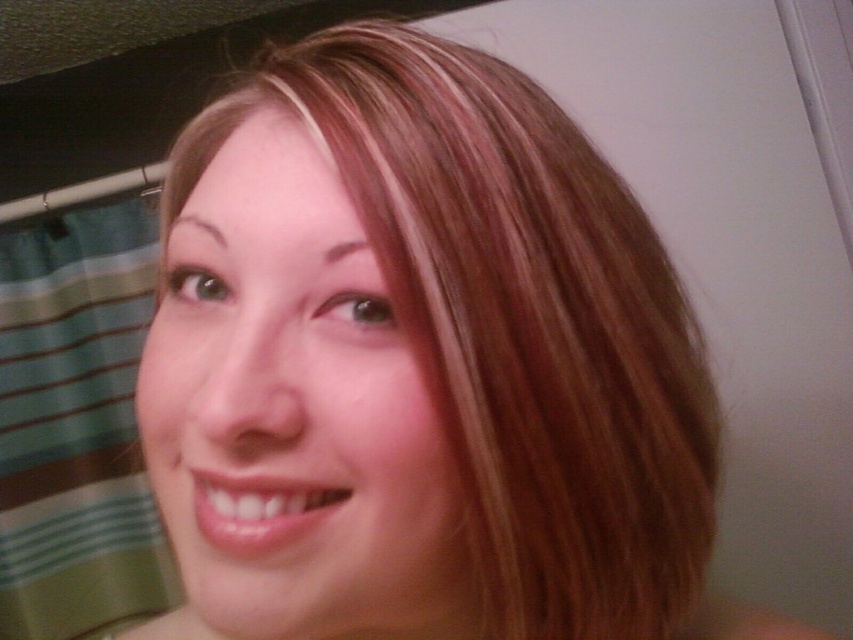
Question: Which point is closer to the camera?

Choices:
 (A) pyautogui.click(x=155, y=385)
 (B) pyautogui.click(x=489, y=561)

Answer: (A)

Question: Does blonde hair at center have a lesser width compared to green striped fabric at left?

Choices:
 (A) yes
 (B) no

Answer: (A)

Question: Which point is closer to the camera?

Choices:
 (A) green striped fabric at left
 (B) blonde hair at center

Answer: (B)

Question: Which object is farther from the camera taking this photo?

Choices:
 (A) green striped fabric at left
 (B) smooth skin face at center

Answer: (A)

Question: Does smooth skin face at center have a larger size compared to green striped fabric at left?

Choices:
 (A) no
 (B) yes

Answer: (A)

Question: Is blonde hair at center closer to camera compared to smooth skin face at center?

Choices:
 (A) no
 (B) yes

Answer: (A)